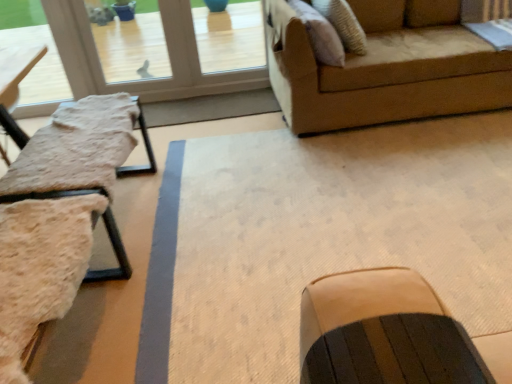
Question: Should I look upward or downward to see transparent glass door at upper left?

Choices:
 (A) down
 (B) up

Answer: (B)

Question: Is fuzzy fabric table at left oriented towards suede-like beige pillow at upper right?

Choices:
 (A) no
 (B) yes

Answer: (B)

Question: Considering the relative positions of fuzzy fabric table at left and suede-like beige pillow at upper right in the image provided, is fuzzy fabric table at left to the left of suede-like beige pillow at upper right from the viewer's perspective?

Choices:
 (A) yes
 (B) no

Answer: (A)

Question: Can you confirm if fuzzy fabric table at left is thinner than suede-like beige pillow at upper right?

Choices:
 (A) no
 (B) yes

Answer: (B)

Question: Is fuzzy fabric table at left taller than suede-like beige pillow at upper right?

Choices:
 (A) yes
 (B) no

Answer: (B)

Question: Is the surface of fuzzy fabric table at left in direct contact with suede-like beige pillow at upper right?

Choices:
 (A) yes
 (B) no

Answer: (B)

Question: Does fuzzy fabric table at left come in front of suede-like beige pillow at upper right?

Choices:
 (A) yes
 (B) no

Answer: (A)

Question: Is suede-like beige pillow at upper right smaller than dark brown leather rocking chair at center?

Choices:
 (A) yes
 (B) no

Answer: (B)

Question: Is suede-like beige pillow at upper right facing towards dark brown leather rocking chair at center?

Choices:
 (A) yes
 (B) no

Answer: (A)

Question: Is suede-like beige pillow at upper right not near dark brown leather rocking chair at center?

Choices:
 (A) no
 (B) yes

Answer: (B)

Question: Can dark brown leather rocking chair at center be found inside suede-like beige pillow at upper right?

Choices:
 (A) no
 (B) yes

Answer: (A)

Question: Can you confirm if suede-like beige pillow at upper right is bigger than dark brown leather rocking chair at center?

Choices:
 (A) yes
 (B) no

Answer: (A)

Question: Considering the relative sizes of suede-like beige pillow at upper right and dark brown leather rocking chair at center in the image provided, is suede-like beige pillow at upper right thinner than dark brown leather rocking chair at center?

Choices:
 (A) no
 (B) yes

Answer: (A)

Question: From the image's perspective, does transparent glass door at upper left appear lower than suede-like beige pillow at upper right?

Choices:
 (A) yes
 (B) no

Answer: (B)